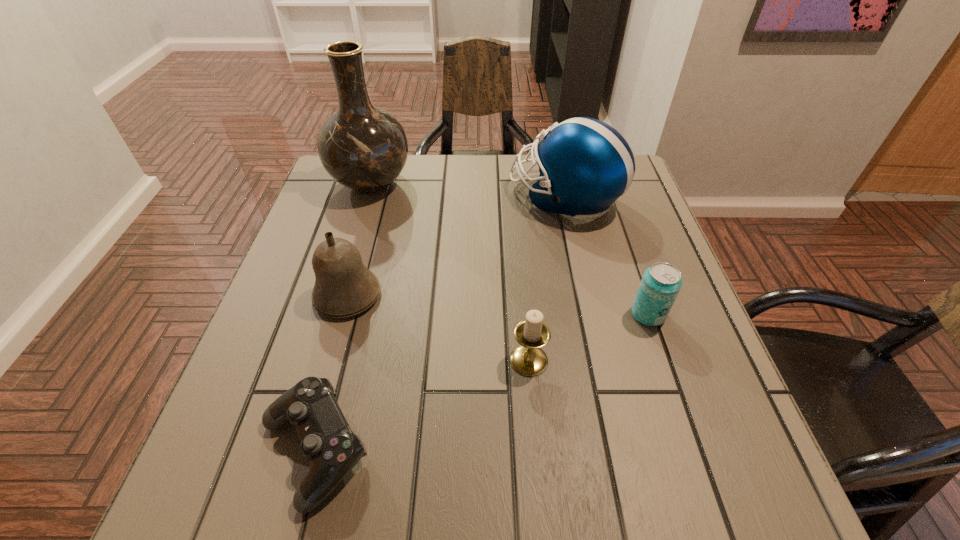
You are a GUI agent. You are given a task and a screenshot of the screen. Output one action in this format:
    pyautogui.click(x=<x>, y=<y>)
    Task: Click on the tallest object
    Image resolution: width=960 pixels, height=540 pixels.
    Given the screenshot: What is the action you would take?
    pyautogui.click(x=363, y=147)

At what (x,y) coordinates should I click in order to perform the action: click on football helmet. Please return your answer as a coordinate pair (x, y). This screenshot has width=960, height=540. Looking at the image, I should click on (585, 165).

Locate an element on the screen. the third tallest object is located at coordinates (344, 287).

Find the location of a particular element. Image resolution: width=960 pixels, height=540 pixels. candle holder is located at coordinates (528, 359).

This screenshot has width=960, height=540. What are the coordinates of `beer can` in the screenshot? It's located at (661, 283).

In order to click on control in this screenshot , I will do `click(327, 442)`.

Image resolution: width=960 pixels, height=540 pixels. I want to click on the shortest object, so 327,442.

The width and height of the screenshot is (960, 540). Identify the location of free space located on the front of the tallest object. (355, 237).

Locate an element on the screen. This screenshot has height=540, width=960. free space located 0.080m at the front of the fifth shortest object with the faceguard is located at coordinates (480, 198).

Identify the location of vacant region located 0.100m at the front of the fifth shortest object with the faceguard. The image size is (960, 540). (472, 198).